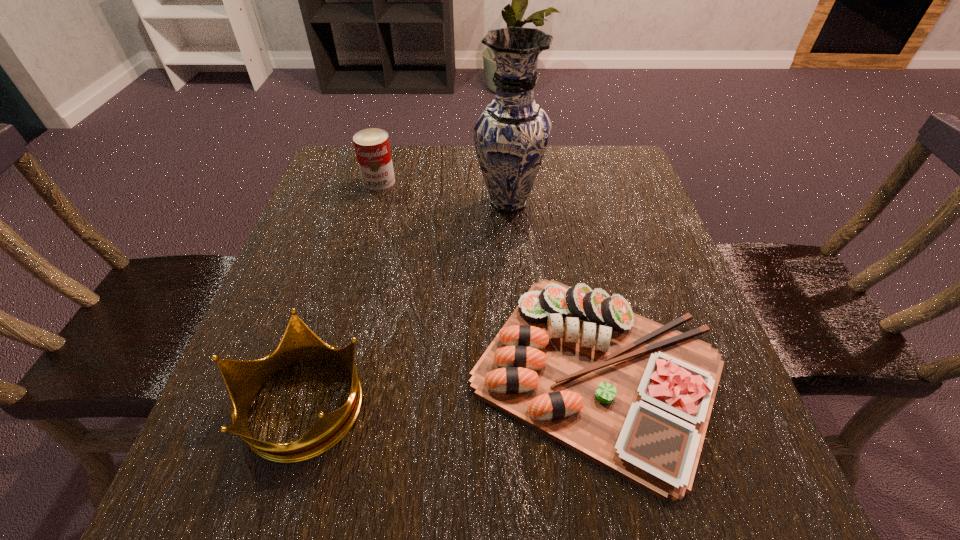
Where is `blank space at the left edge`? This screenshot has width=960, height=540. blank space at the left edge is located at coordinates (371, 218).

The height and width of the screenshot is (540, 960). In order to click on vacant space at the right edge of the desktop in this screenshot , I will do `click(668, 284)`.

Locate an element on the screen. The width and height of the screenshot is (960, 540). vacant space at the far left corner of the desktop is located at coordinates (318, 191).

The width and height of the screenshot is (960, 540). In the image, there is a desktop. Identify the location of vacant space at the near left corner. (183, 497).

This screenshot has width=960, height=540. In the image, there is a desktop. What are the coordinates of `vacant space at the far right corner` in the screenshot? It's located at (613, 158).

You are a GUI agent. You are given a task and a screenshot of the screen. Output one action in this format:
    pyautogui.click(x=<x>, y=<y>)
    Task: Click on the free spot at the near right corner of the desktop
    This screenshot has height=540, width=960.
    Given the screenshot: What is the action you would take?
    pyautogui.click(x=711, y=461)

Locate an element on the screen. The width and height of the screenshot is (960, 540). free space that is in between the platter and the can is located at coordinates pos(488,276).

You are a GUI agent. You are given a task and a screenshot of the screen. Output one action in this format:
    pyautogui.click(x=<x>, y=<y>)
    Task: Click on the vacant region between the crown and the vase
    This screenshot has width=960, height=540.
    Given the screenshot: What is the action you would take?
    pyautogui.click(x=405, y=303)

Identify the location of vacant area that lies between the crown and the can. The width and height of the screenshot is (960, 540). (341, 292).

Locate an element on the screen. This screenshot has height=540, width=960. empty space between the can and the vase is located at coordinates (444, 192).